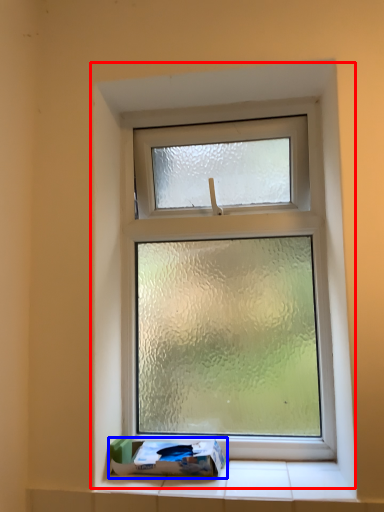
Question: Which of the following is the closest to the observer, window (highlighted by a red box) or box (highlighted by a blue box)?

Choices:
 (A) window
 (B) box

Answer: (B)